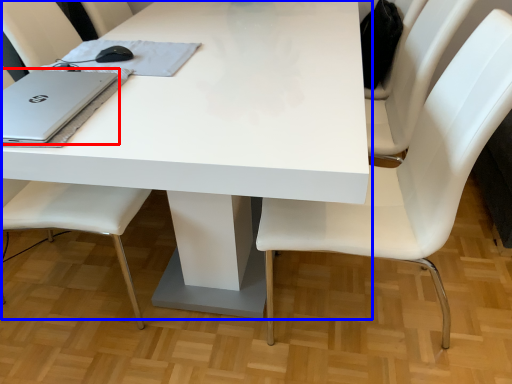
Question: Among these objects, which one is nearest to the camera, laptop (highlighted by a red box) or table (highlighted by a blue box)?

Choices:
 (A) laptop
 (B) table

Answer: (B)